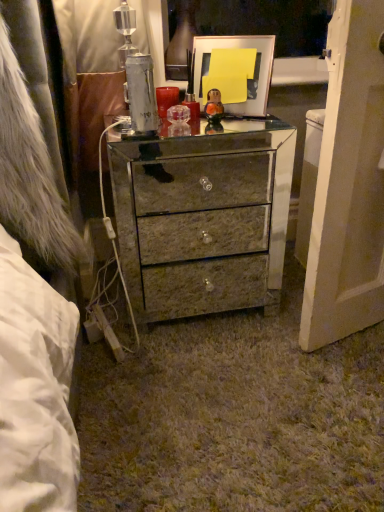
Image resolution: width=384 pixels, height=512 pixels. What do you see at coordinates (235, 71) in the screenshot?
I see `metallic gold picture frame at upper center` at bounding box center [235, 71].

Identify the location of metallic gold picture frame at upper center. Image resolution: width=384 pixels, height=512 pixels. (235, 71).

What is the approximate width of metallic gold picture frame at upper center?

metallic gold picture frame at upper center is 3.46 inches in width.

The height and width of the screenshot is (512, 384). What are the coordinates of `mirrored glass chest of drawers at center` in the screenshot? It's located at (203, 219).

What do you see at coordinates (203, 219) in the screenshot?
I see `mirrored glass chest of drawers at center` at bounding box center [203, 219].

You are a GUI agent. You are given a task and a screenshot of the screen. Output one action in this format:
    pyautogui.click(x=<x>, y=<y>)
    Task: Click on the metallic gold picture frame at upper center
    The image size is (384, 512).
    Given the screenshot: What is the action you would take?
    pyautogui.click(x=235, y=71)

Consider the image. Considering the relative positions of mirrored glass chest of drawers at center and metallic gold picture frame at upper center in the image provided, is mirrored glass chest of drawers at center to the left of metallic gold picture frame at upper center from the viewer's perspective?

Yes.

Considering the positions of objects mirrored glass chest of drawers at center and metallic gold picture frame at upper center in the image provided, who is behind, mirrored glass chest of drawers at center or metallic gold picture frame at upper center?

metallic gold picture frame at upper center is behind.

Considering the points (234, 233) and (197, 50), which point is behind, point (234, 233) or point (197, 50)?

Point (234, 233)

From the image's perspective, which one is positioned lower, mirrored glass chest of drawers at center or metallic gold picture frame at upper center?

mirrored glass chest of drawers at center.

From a real-world perspective, is mirrored glass chest of drawers at center positioned above or below metallic gold picture frame at upper center?

mirrored glass chest of drawers at center is situated lower than metallic gold picture frame at upper center in the real world.

Considering the sizes of mirrored glass chest of drawers at center and metallic gold picture frame at upper center in the image, is mirrored glass chest of drawers at center wider or thinner than metallic gold picture frame at upper center?

In the image, mirrored glass chest of drawers at center appears to be wider than metallic gold picture frame at upper center.

Considering the relative sizes of mirrored glass chest of drawers at center and metallic gold picture frame at upper center in the image provided, is mirrored glass chest of drawers at center shorter than metallic gold picture frame at upper center?

In fact, mirrored glass chest of drawers at center may be taller than metallic gold picture frame at upper center.

Considering the sizes of mirrored glass chest of drawers at center and metallic gold picture frame at upper center in the image, is mirrored glass chest of drawers at center bigger or smaller than metallic gold picture frame at upper center?

Clearly, mirrored glass chest of drawers at center is larger in size than metallic gold picture frame at upper center.

Could metallic gold picture frame at upper center be considered to be inside mirrored glass chest of drawers at center?

Definitely not — metallic gold picture frame at upper center is not inside mirrored glass chest of drawers at center.

Is mirrored glass chest of drawers at center placed right next to metallic gold picture frame at upper center?

No, mirrored glass chest of drawers at center is not in contact with metallic gold picture frame at upper center.

Does mirrored glass chest of drawers at center turn towards metallic gold picture frame at upper center?

No, mirrored glass chest of drawers at center does not turn towards metallic gold picture frame at upper center.

Could you measure the distance between mirrored glass chest of drawers at center and metallic gold picture frame at upper center?

The distance of mirrored glass chest of drawers at center from metallic gold picture frame at upper center is 12.94 inches.

What are the coordinates of `picture frame that is on the right side of mirrored glass chest of drawers at center` in the screenshot? It's located at (235, 71).

Between metallic gold picture frame at upper center and mirrored glass chest of drawers at center, which one appears on the right side from the viewer's perspective?

From the viewer's perspective, metallic gold picture frame at upper center appears more on the right side.

Consider the image. Which object is closer to the camera taking this photo, metallic gold picture frame at upper center or mirrored glass chest of drawers at center?

mirrored glass chest of drawers at center is more forward.

Is point (201, 77) closer or farther from the camera than point (244, 266)?

Point (201, 77) is positioned closer to the camera compared to point (244, 266).

From the image's perspective, relative to mirrored glass chest of drawers at center, is metallic gold picture frame at upper center above or below?

metallic gold picture frame at upper center is situated higher than mirrored glass chest of drawers at center in the image.

From a real-world perspective, which is physically above, metallic gold picture frame at upper center or mirrored glass chest of drawers at center?

From a 3D spatial view, metallic gold picture frame at upper center is above.

Considering the sizes of objects metallic gold picture frame at upper center and mirrored glass chest of drawers at center in the image provided, who is wider, metallic gold picture frame at upper center or mirrored glass chest of drawers at center?

Wider between the two is mirrored glass chest of drawers at center.

Considering the sizes of objects metallic gold picture frame at upper center and mirrored glass chest of drawers at center in the image provided, who is shorter, metallic gold picture frame at upper center or mirrored glass chest of drawers at center?

metallic gold picture frame at upper center.

Between metallic gold picture frame at upper center and mirrored glass chest of drawers at center, which one has larger size?

With larger size is mirrored glass chest of drawers at center.

Is metallic gold picture frame at upper center completely or partially outside of mirrored glass chest of drawers at center?

Yes.

From the picture: Would you consider metallic gold picture frame at upper center to be distant from mirrored glass chest of drawers at center?

metallic gold picture frame at upper center is actually quite close to mirrored glass chest of drawers at center.

Could you tell me if metallic gold picture frame at upper center is turned towards mirrored glass chest of drawers at center?

No, metallic gold picture frame at upper center is not facing towards mirrored glass chest of drawers at center.

How distant is metallic gold picture frame at upper center from mirrored glass chest of drawers at center?

metallic gold picture frame at upper center is 32.87 centimeters away from mirrored glass chest of drawers at center.

You are a GUI agent. You are given a task and a screenshot of the screen. Output one action in this format:
    pyautogui.click(x=<x>, y=<y>)
    Task: Click on the chest of drawers beneath the metallic gold picture frame at upper center (from a real-world perspective)
    Image resolution: width=384 pixels, height=512 pixels.
    Given the screenshot: What is the action you would take?
    pyautogui.click(x=203, y=219)

This screenshot has height=512, width=384. I want to click on chest of drawers on the left of metallic gold picture frame at upper center, so click(203, 219).

Find the location of a particular element. This screenshot has height=512, width=384. chest of drawers in front of the metallic gold picture frame at upper center is located at coordinates coord(203,219).